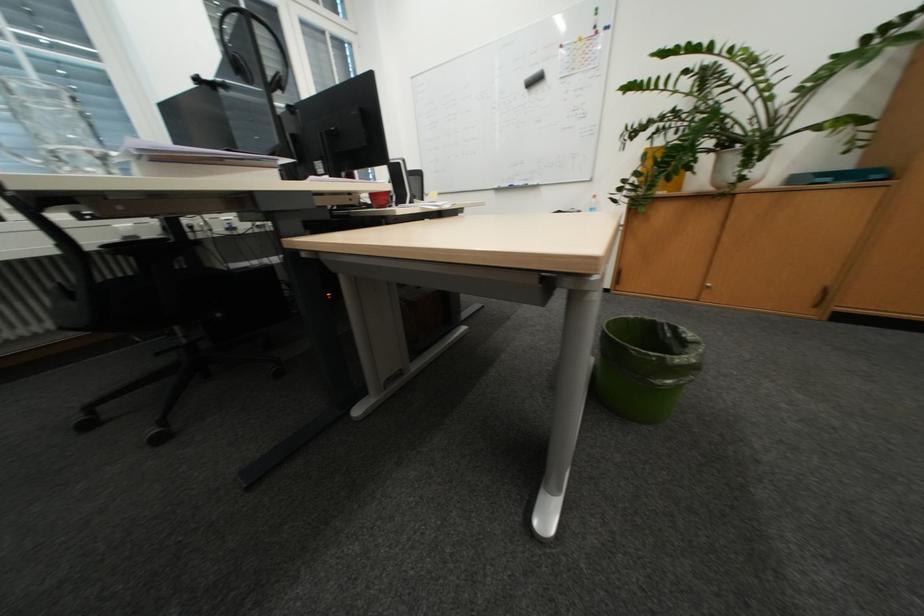
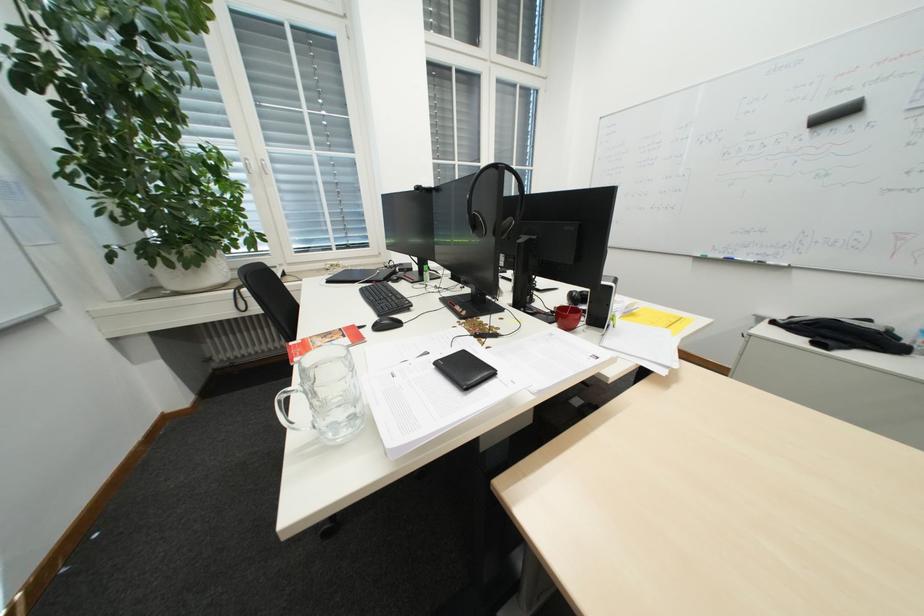
Question: How did the camera likely rotate?

Choices:
 (A) Left
 (B) Right
 (C) Up
 (D) Down

Answer: (A)